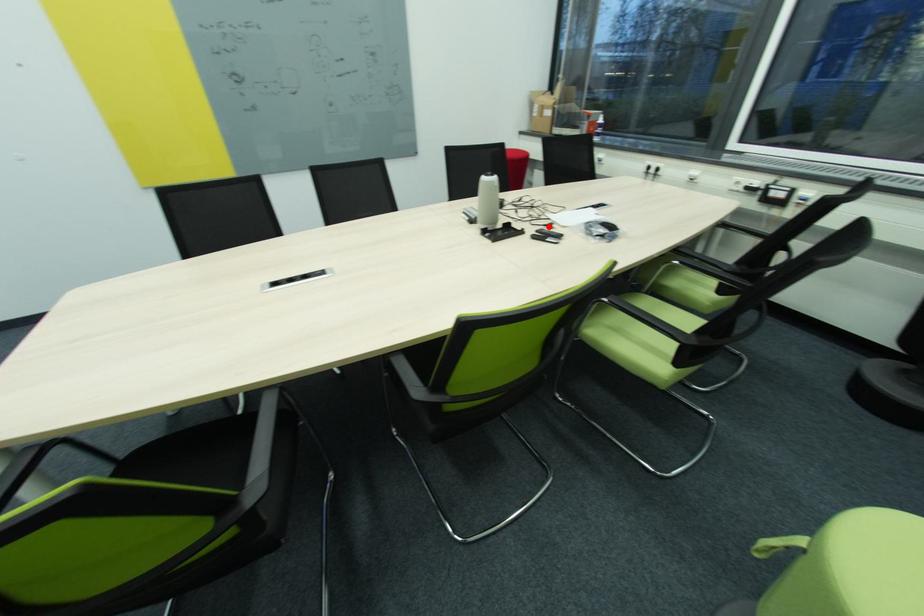
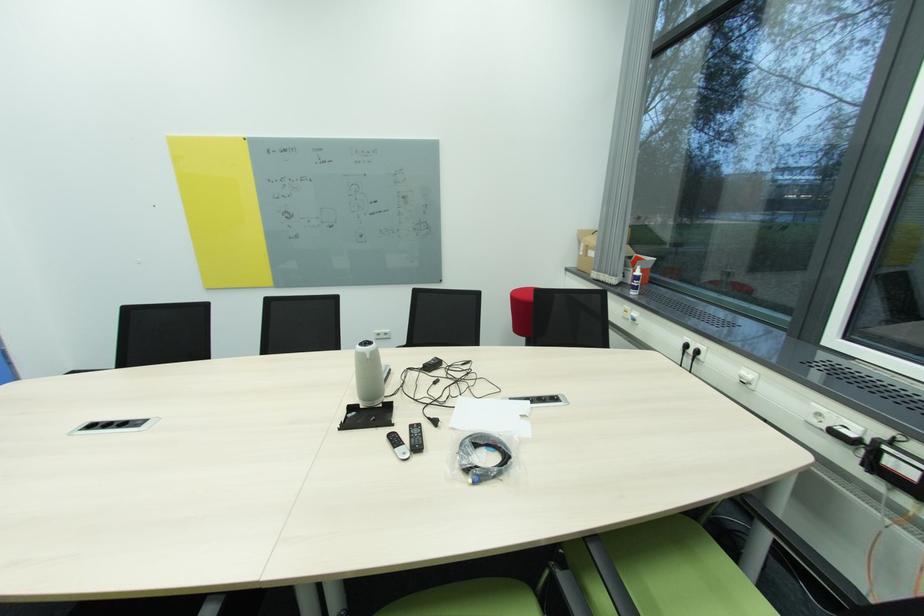
The point at the highlighted location is marked in the first image. Where is the corresponding point in the second image?

(433, 419)